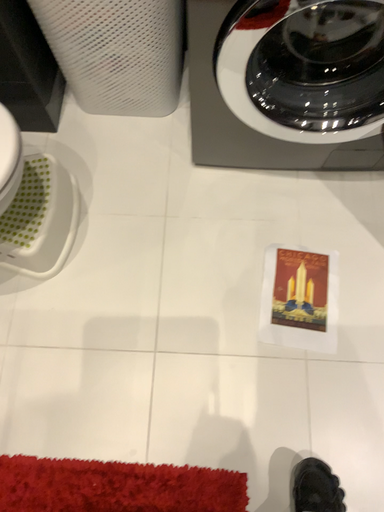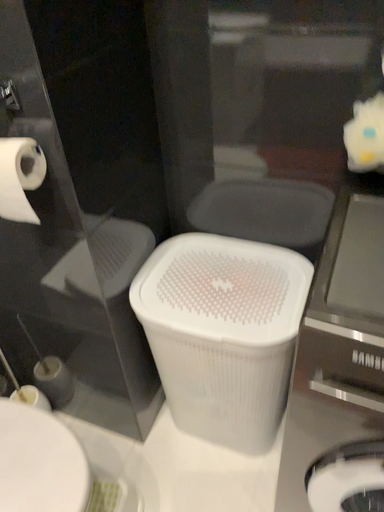
Question: How did the camera likely rotate when shooting the video?

Choices:
 (A) rotated upward
 (B) rotated downward

Answer: (A)